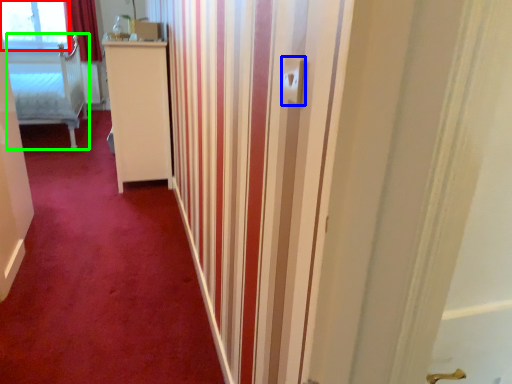
Question: Which object is the farthest from window (highlighted by a red box)? Choose among these: electric outlet (highlighted by a blue box) or furniture (highlighted by a green box).

Choices:
 (A) electric outlet
 (B) furniture

Answer: (A)